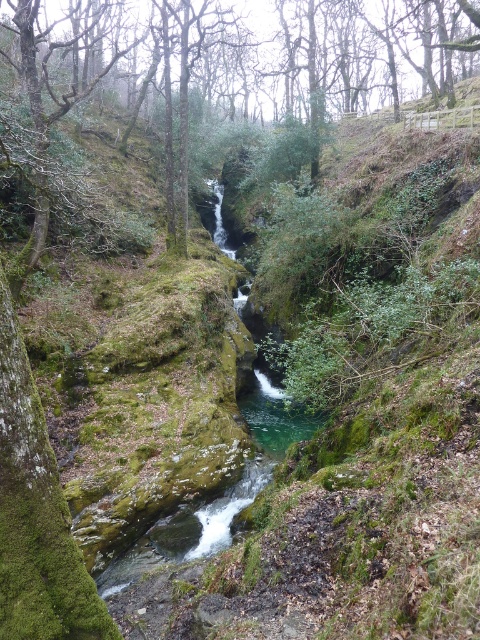
Which is in front, point (192, 44) or point (265, 374)?

Point (265, 374)

Does green mossy rock at center have a lesser height compared to clear water at center?

No.

Based on the photo, measure the distance between green mossy rock at center and camera.

green mossy rock at center and camera are 9.58 meters apart from each other.

I want to click on green mossy rock at center, so click(x=244, y=60).